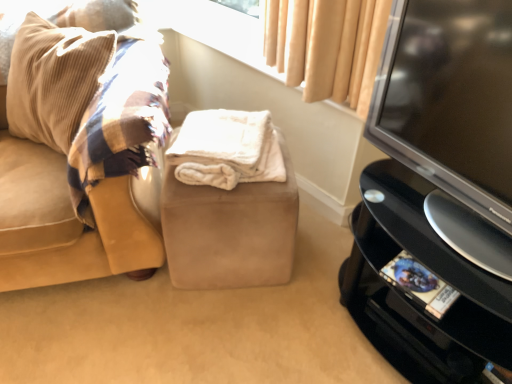
Question: Is beige fabric at upper center oriented towards suede beige stool at center?

Choices:
 (A) no
 (B) yes

Answer: (A)

Question: Are beige fabric at upper center and suede beige stool at center far apart?

Choices:
 (A) no
 (B) yes

Answer: (A)

Question: Can you confirm if beige fabric at upper center is positioned to the left of suede beige stool at center?

Choices:
 (A) no
 (B) yes

Answer: (A)

Question: Is beige fabric at upper center looking in the opposite direction of suede beige stool at center?

Choices:
 (A) yes
 (B) no

Answer: (B)

Question: Is beige fabric at upper center placed right next to suede beige stool at center?

Choices:
 (A) yes
 (B) no

Answer: (B)

Question: In terms of size, does white fluffy blanket at center appear bigger or smaller than black plastic tv stand at right?

Choices:
 (A) big
 (B) small

Answer: (B)

Question: From a real-world perspective, is white fluffy blanket at center physically located above or below black plastic tv stand at right?

Choices:
 (A) below
 (B) above

Answer: (B)

Question: From their relative heights in the image, would you say white fluffy blanket at center is taller or shorter than black plastic tv stand at right?

Choices:
 (A) tall
 (B) short

Answer: (B)

Question: Is point (200, 162) closer or farther from the camera than point (404, 173)?

Choices:
 (A) closer
 (B) farther

Answer: (B)

Question: Is suede beige stool at center bigger or smaller than suede couch at left?

Choices:
 (A) small
 (B) big

Answer: (A)

Question: Would you say suede beige stool at center is inside or outside suede couch at left?

Choices:
 (A) outside
 (B) inside

Answer: (A)

Question: Is suede beige stool at center to the left or to the right of suede couch at left in the image?

Choices:
 (A) left
 (B) right

Answer: (B)

Question: Considering the positions of suede beige stool at center and suede couch at left in the image, is suede beige stool at center taller or shorter than suede couch at left?

Choices:
 (A) tall
 (B) short

Answer: (B)

Question: From a real-world perspective, relative to suede beige stool at center, is white fluffy blanket at center vertically above or below?

Choices:
 (A) below
 (B) above

Answer: (B)

Question: From their relative heights in the image, would you say white fluffy blanket at center is taller or shorter than suede beige stool at center?

Choices:
 (A) short
 (B) tall

Answer: (A)